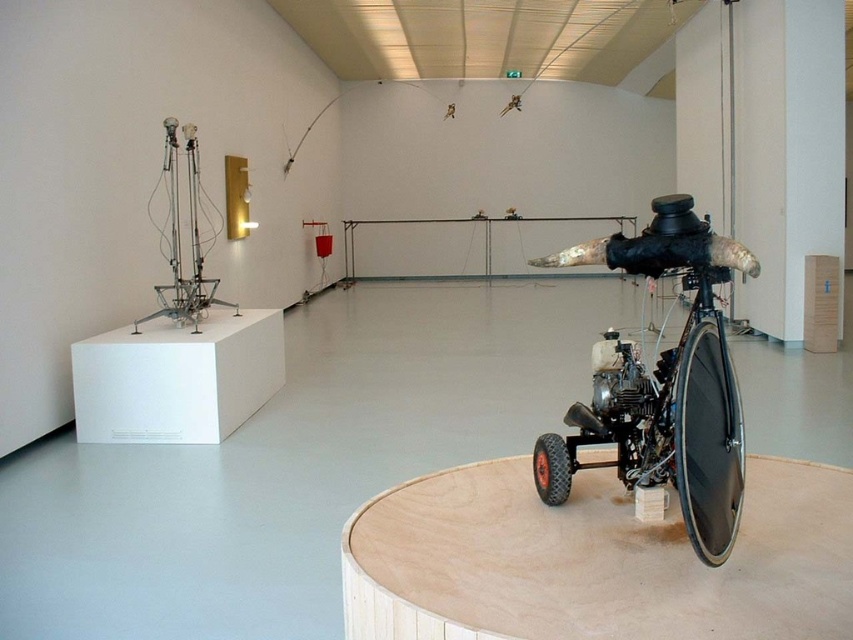
Question: Which point is farther to the camera?

Choices:
 (A) black rubber wheel at lower right
 (B) rubber/textured wheel at lower center
 (C) metallic matte bicycle at center

Answer: (B)

Question: Is metallic matte bicycle at center above black rubber wheel at lower right?

Choices:
 (A) yes
 (B) no

Answer: (A)

Question: Which object is farther from the camera taking this photo?

Choices:
 (A) black rubber wheel at lower right
 (B) rubber/textured wheel at lower center

Answer: (B)

Question: Is metallic matte bicycle at center in front of rubber/textured wheel at lower center?

Choices:
 (A) no
 (B) yes

Answer: (B)

Question: Which object appears farthest from the camera in this image?

Choices:
 (A) black rubber wheel at lower right
 (B) metallic matte bicycle at center
 (C) rubber/textured wheel at lower center

Answer: (C)

Question: Is black rubber wheel at lower right positioned at the back of rubber/textured wheel at lower center?

Choices:
 (A) no
 (B) yes

Answer: (A)